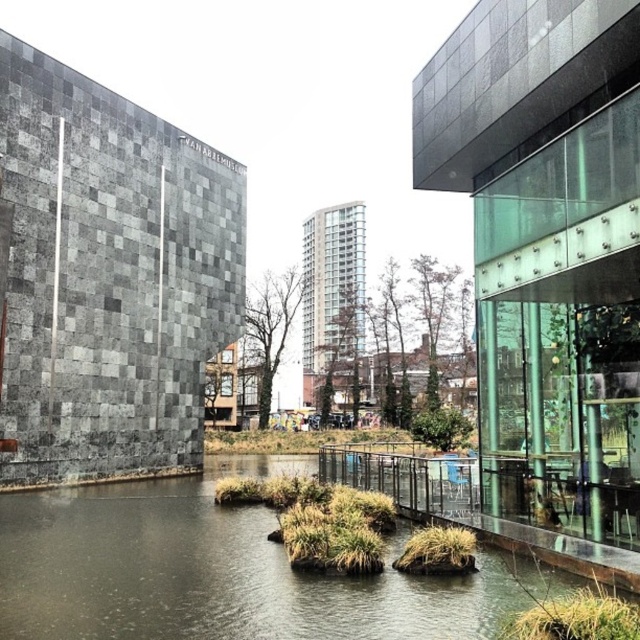
Question: Which of the following is the farthest from the observer?

Choices:
 (A) (196, 637)
 (B) (563, 620)
 (C) (413, 540)

Answer: (C)

Question: Observing the image, what is the correct spatial positioning of dark gray concrete river at center in reference to green grass at center?

Choices:
 (A) right
 (B) left

Answer: (B)

Question: Does dark gray concrete river at center have a lesser width compared to green grass at center?

Choices:
 (A) no
 (B) yes

Answer: (A)

Question: Based on their relative distances, which object is farther from the dark gray concrete river at center?

Choices:
 (A) green grass at lower center
 (B) green grass at center

Answer: (A)

Question: Which object is the closest to the dark gray concrete river at center?

Choices:
 (A) green grass at lower center
 (B) green grass at center

Answer: (B)

Question: Is the position of green grass at lower center less distant than that of green grass at center?

Choices:
 (A) no
 (B) yes

Answer: (B)